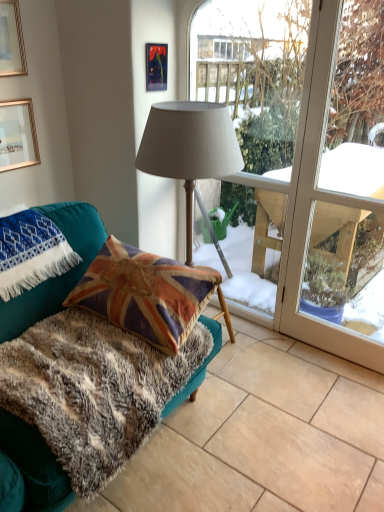
Question: Looking at their shapes, would you say teal fabric couch at lower left is wider or thinner than matte fabric lamp at center?

Choices:
 (A) thin
 (B) wide

Answer: (B)

Question: In the image, is teal fabric couch at lower left positioned in front of or behind matte fabric lamp at center?

Choices:
 (A) front
 (B) behind

Answer: (A)

Question: Estimate the real-world distances between objects in this image. Which object is farther from the blue embroidered blanket at lower left?

Choices:
 (A) transparent glass window at center
 (B) gold-framed picture at upper left, marked as the 1th picture frame in a left-to-right arrangement
 (C) gold-framed picture at upper left, which is the 2th picture frame in right-to-left order
 (D) teal fabric couch at lower left
 (E) fuzzy fabric rug at lower left

Answer: (A)

Question: Which object is positioned farthest from the transparent glass window at center?

Choices:
 (A) matte plastic picture frame at upper center, which is counted as the 3th picture frame, starting from the left
 (B) matte fabric lamp at center
 (C) teal fabric couch at lower left
 (D) blue embroidered blanket at lower left
 (E) gold-framed picture at upper left, marked as the 1th picture frame in a left-to-right arrangement

Answer: (C)